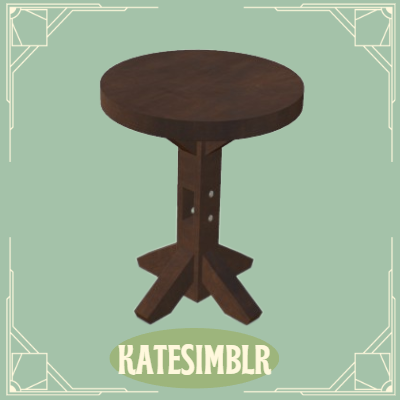
Locate an element on the screen. The height and width of the screenshot is (400, 400). tabletop is located at coordinates (235, 105).